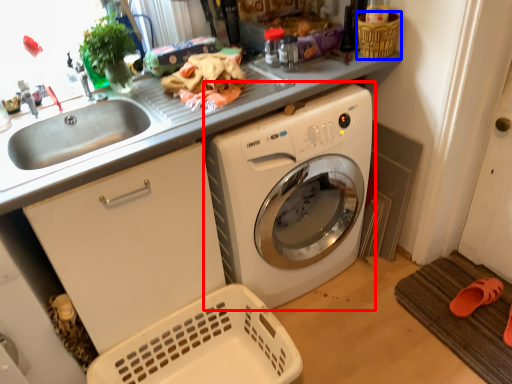
Question: Which point is further to the camera, washing machine (highlighted by a red box) or basket (highlighted by a blue box)?

Choices:
 (A) washing machine
 (B) basket

Answer: (B)